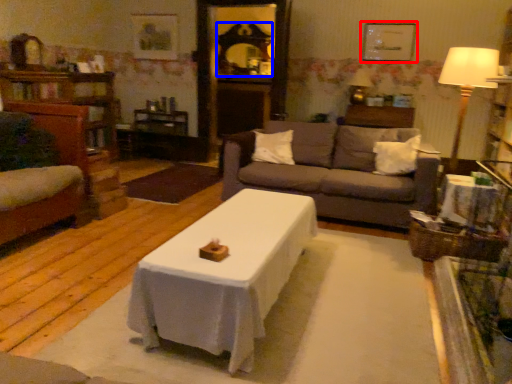
Question: Which of the following is the closest to the observer, picture frame (highlighted by a red box) or mirror (highlighted by a blue box)?

Choices:
 (A) picture frame
 (B) mirror

Answer: (A)